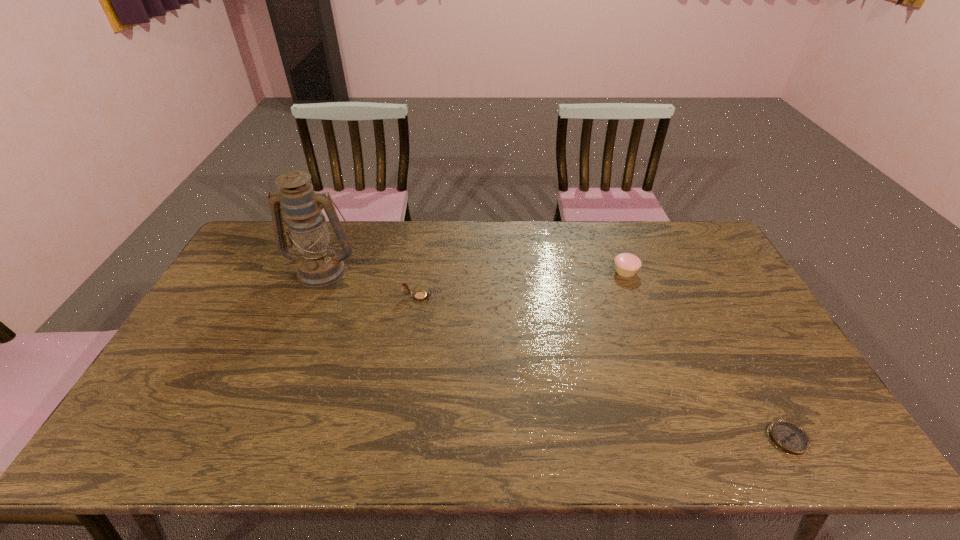
I want to click on unoccupied area between the rightmost object and the cupcake, so click(x=707, y=355).

At what (x,y) coordinates should I click in order to perform the action: click on empty space between the farther compass and the shorter compass. Please return your answer as a coordinate pair (x, y). The height and width of the screenshot is (540, 960). Looking at the image, I should click on (603, 368).

Locate an element on the screen. This screenshot has width=960, height=540. free space between the left compass and the cupcake is located at coordinates (521, 284).

Identify the location of empty space that is in between the oil lamp and the third object from right to left. The image size is (960, 540). (371, 284).

Find the location of a particular element. This screenshot has height=540, width=960. free space between the cupcake and the third object from right to left is located at coordinates (521, 284).

Find the location of `vacant region between the second object from right to left and the third farthest object`. vacant region between the second object from right to left and the third farthest object is located at coordinates (521, 284).

What are the coordinates of `vacant space that's between the third farthest object and the cupcake` in the screenshot? It's located at (521, 284).

You are a GUI agent. You are given a task and a screenshot of the screen. Output one action in this format:
    pyautogui.click(x=<x>, y=<y>)
    Task: Click on the free space that is in between the second object from right to left and the rightmost object
    This screenshot has height=540, width=960.
    Given the screenshot: What is the action you would take?
    pyautogui.click(x=707, y=355)

The height and width of the screenshot is (540, 960). Identify the location of vacant space in between the farther compass and the shorter compass. (603, 368).

Where is `the third closest object relative to the shorter compass`? the third closest object relative to the shorter compass is located at coordinates (319, 265).